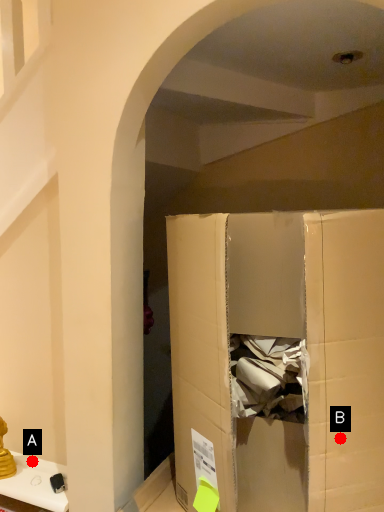
Question: Two points are circled on the image, labeled by A and B beside each circle. Which point is closer to the camera?

Choices:
 (A) A is closer
 (B) B is closer

Answer: (B)